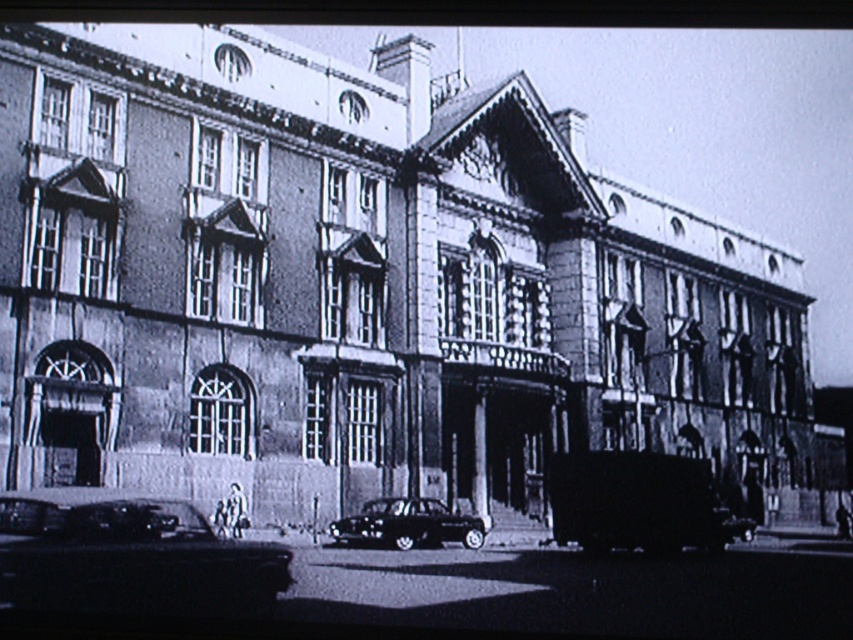
Question: Is shiny black car at lower left bigger than shiny black car at center?

Choices:
 (A) no
 (B) yes

Answer: (B)

Question: Does shiny black car at lower left come behind shiny black car at center?

Choices:
 (A) no
 (B) yes

Answer: (A)

Question: Can you confirm if shiny black car at lower left is positioned above shiny black car at center?

Choices:
 (A) no
 (B) yes

Answer: (B)

Question: Which point is farther to the camera?

Choices:
 (A) shiny black car at lower left
 (B) shiny black car at center

Answer: (B)

Question: Which point is closer to the camera?

Choices:
 (A) (379, 516)
 (B) (108, 547)

Answer: (B)

Question: Which point is closer to the camera?

Choices:
 (A) shiny black car at lower left
 (B) shiny black car at center

Answer: (A)